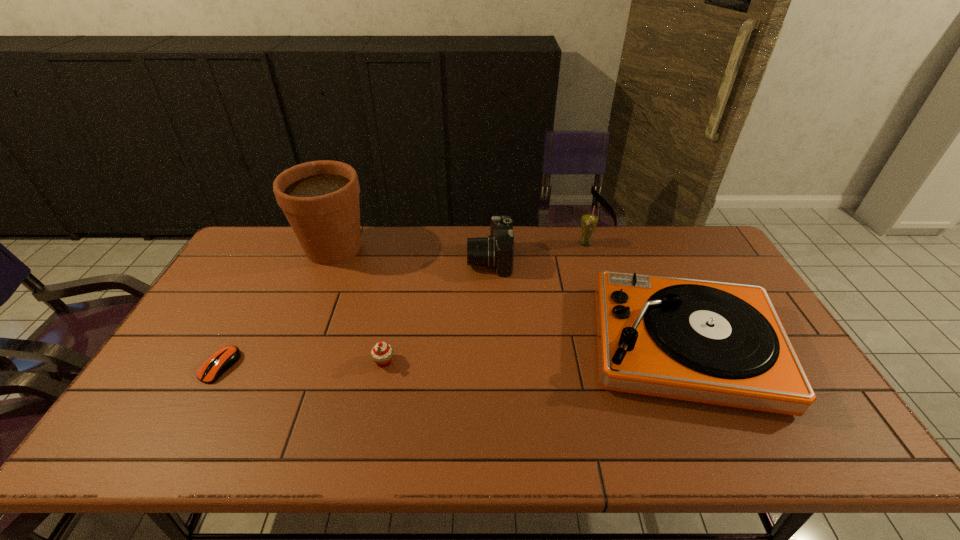
Where is `the fifth object from right to left`? Image resolution: width=960 pixels, height=540 pixels. the fifth object from right to left is located at coordinates (320, 199).

The image size is (960, 540). I want to click on flowerpot, so click(x=320, y=199).

What are the coordinates of `straw for drinking` in the screenshot? It's located at (589, 221).

This screenshot has width=960, height=540. I want to click on camera, so click(496, 251).

At what (x,y) coordinates should I click in order to perform the action: click on record player. Please return your answer as a coordinate pair (x, y). Looking at the image, I should click on (719, 343).

Locate an element on the screen. the third object from left to right is located at coordinates pos(382,353).

Identify the location of cupcake. This screenshot has width=960, height=540. (382, 353).

The height and width of the screenshot is (540, 960). I want to click on the leftmost object, so click(219, 362).

Find the location of a particular element. The width and height of the screenshot is (960, 540). the shortest object is located at coordinates (219, 362).

Identify the location of vacant space situated on the right of the second object from left to right. This screenshot has width=960, height=540. (449, 248).